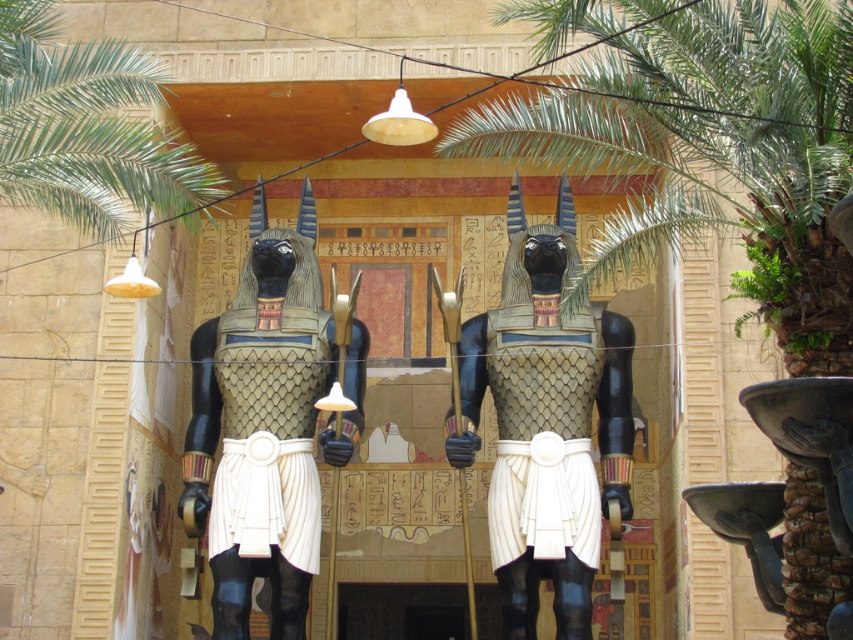
You are an archaeologist examining an ancient Egyptian temple. You notice the matte black statue at center and the green leafy palm at upper left in the scene. Based on their positions, which object is closer to the ground?

The matte black statue at center is closer to the ground because it is positioned below the green leafy palm at upper left.

You are an archaeologist examining the ancient Egyptian scene. You notice the green leafy palm tree at center and the matte black statue at center. Based on their positions, which object is positioned higher in the image?

The green leafy palm tree at center is located above the matte black statue at center, so it is positioned higher in the image.

You are an archaeologist examining the ancient Egyptian scene. You notice the matte black statue at center and the green leafy palm at upper left. Based on their sizes in the image, which object would appear closer to you?

The matte black statue at center is smaller than the green leafy palm at upper left, which suggests that the statue is farther away since objects closer to the viewer typically appear larger.